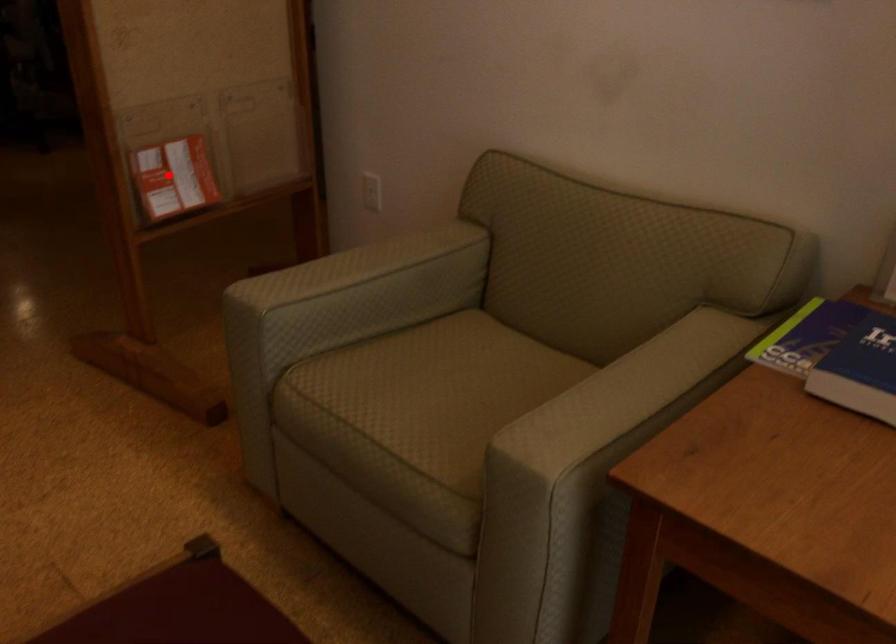
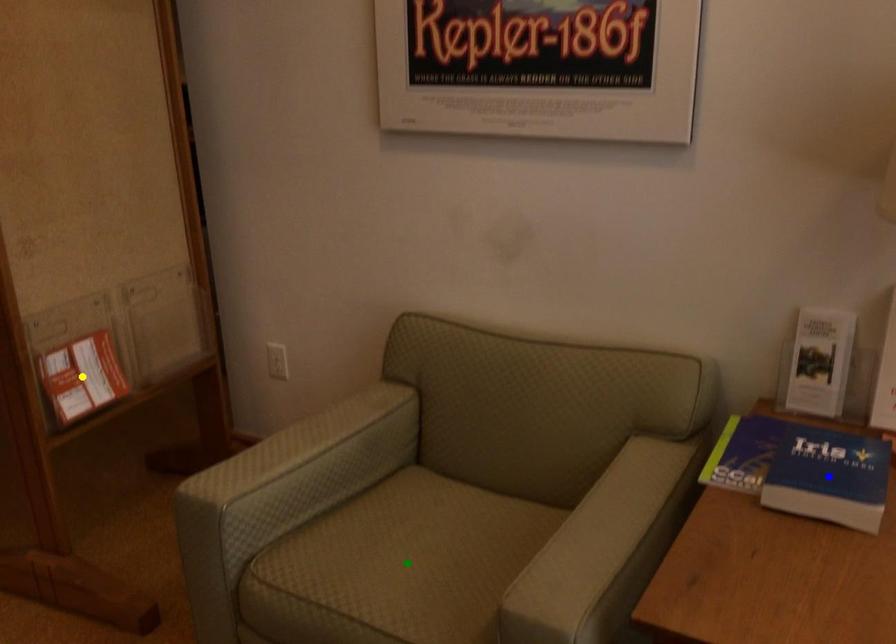
Question: I am providing you with two images of the same scene from different viewpoints. A red point is marked on the first image. You are given multiple points on the second image. Can you choose the point in image 2 that corresponds to the point in image 1?

Choices:
 (A) blue point
 (B) yellow point
 (C) green point

Answer: (B)